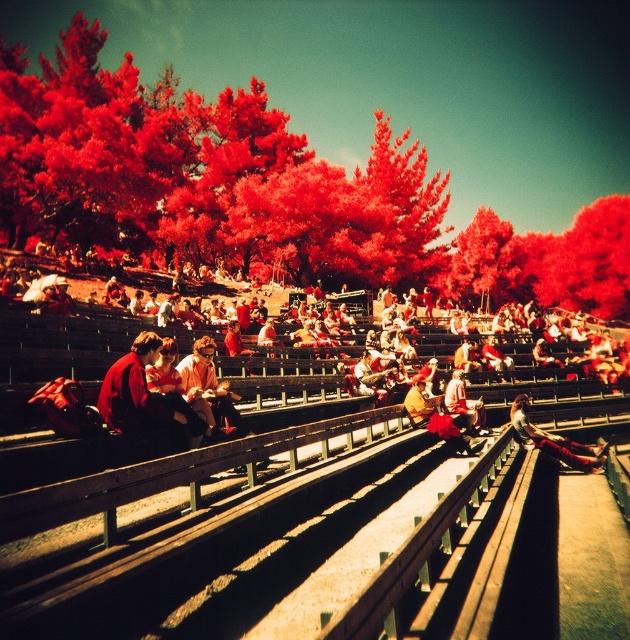
You are a photographer standing at the center of the stadium bleachers. You notice a point marked at coordinates (203, 173). What object is located at that point?

The point at coordinates (203, 173) is where the red textured trees at upper left are located.

You are standing at the center of the bleachers and see a point marked at coordinates (x=525, y=360). Which object is this point located on?

The point at (x=525, y=360) is located on the matte red backpack at center.

Based on the photo, you are attending an event at the stadium and need to find a shaded spot to rest. You see a matte red backpack at center and a red textured tree at center. Which object provides shade, and where should you place yourself relative to the backpack to stay under the shade?

The red textured tree at center provides shade. To stay under the shade, you should position yourself under the red textured tree at center, where the matte red backpack at center is already placed since it is positioned under the red textured tree at center.